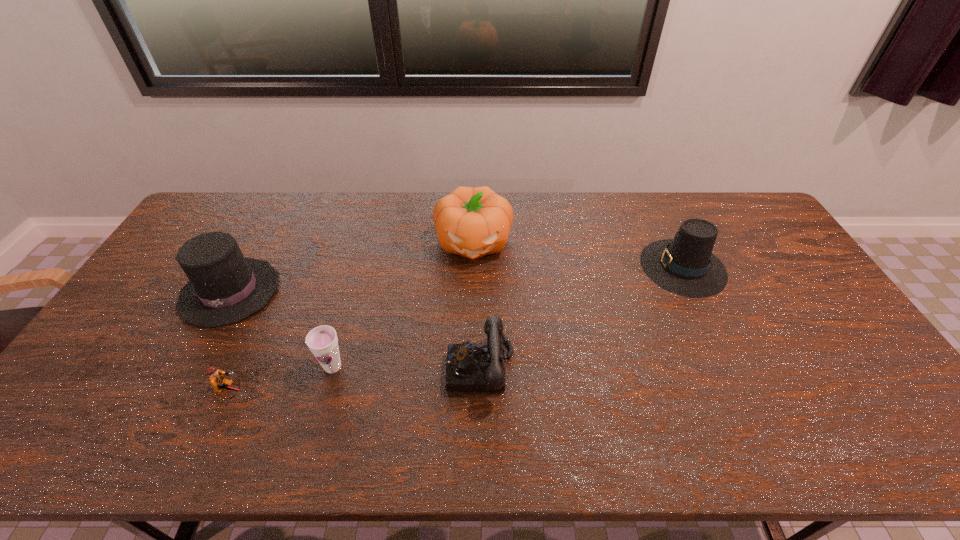
Find the location of a particular element. This screenshot has width=960, height=540. vacant region at the right edge of the desktop is located at coordinates (812, 302).

Locate an element on the screen. The height and width of the screenshot is (540, 960). free space between the cup and the pumpkin is located at coordinates (403, 305).

Identify the location of free area in between the Lego and the pumpkin. The height and width of the screenshot is (540, 960). (352, 316).

The width and height of the screenshot is (960, 540). I want to click on free space between the pumpkin and the telephone, so click(477, 305).

Where is `free spot between the shortest object and the left hat`? free spot between the shortest object and the left hat is located at coordinates (230, 341).

This screenshot has height=540, width=960. Find the location of `free space between the right hat and the cup`. free space between the right hat and the cup is located at coordinates (508, 317).

Locate an element on the screen. The image size is (960, 540). free spot between the pumpkin and the left hat is located at coordinates (351, 267).

The width and height of the screenshot is (960, 540). Find the location of `vacant space in between the telephone and the right hat`. vacant space in between the telephone and the right hat is located at coordinates (582, 317).

Where is `empty space that is in between the pumpkin and the cup`? empty space that is in between the pumpkin and the cup is located at coordinates (403, 305).

Identify the location of free space between the left hat and the right hat. (457, 279).